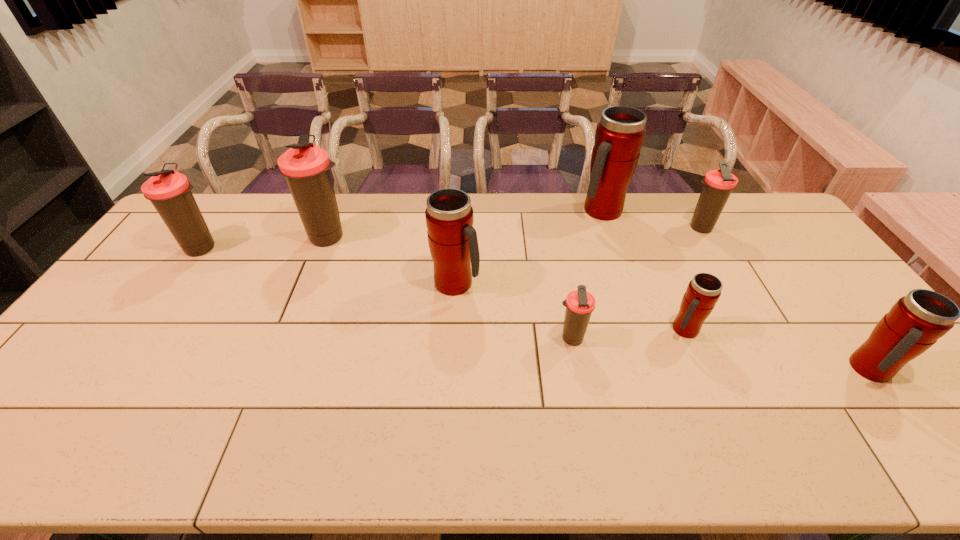
The height and width of the screenshot is (540, 960). I want to click on free region located on the side with the handle of the smallest red thermos bottle, so click(709, 389).

The height and width of the screenshot is (540, 960). What are the coordinates of `free space located on the left of the nearest brown thermos bottle` in the screenshot? It's located at (538, 339).

This screenshot has width=960, height=540. Find the location of `object that is at the left edge`. object that is at the left edge is located at coordinates (169, 191).

You are a GUI agent. You are given a task and a screenshot of the screen. Output one action in this format:
    pyautogui.click(x=<x>, y=<y>)
    Task: Click on the object that is at the right edge
    The height and width of the screenshot is (540, 960).
    Given the screenshot: What is the action you would take?
    (x=916, y=321)

The width and height of the screenshot is (960, 540). What are the coordinates of `blank area at the far edge` in the screenshot? It's located at (411, 217).

Find the location of `vacant space at the near edge of the desktop`. vacant space at the near edge of the desktop is located at coordinates (172, 457).

In the image, there is a desktop. Where is `free space at the left edge`? free space at the left edge is located at coordinates (154, 281).

Identify the location of vacant region at the right edge of the desktop. Image resolution: width=960 pixels, height=540 pixels. (916, 404).

Image resolution: width=960 pixels, height=540 pixels. Identify the location of free spot between the biggest red thermos bottle and the second smallest red thermos bottle. (735, 291).

Locate an element on the screen. empty space that is in between the farthest red thermos bottle and the rightmost red thermos bottle is located at coordinates (735, 291).